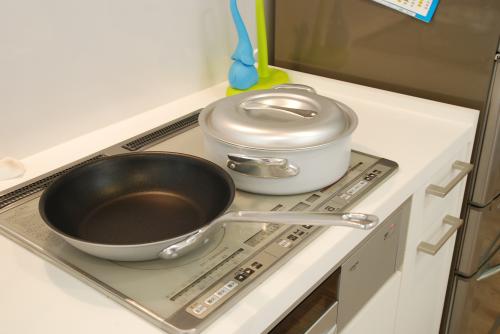
I want to click on silver frying pan on stove top, so click(x=141, y=195).